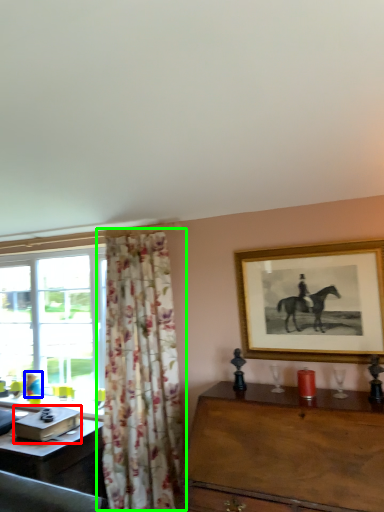
Question: Based on their relative distances, which object is farther from box (highlighted by a red box)? Choose from person (highlighted by a blue box) and curtain (highlighted by a green box).

Choices:
 (A) person
 (B) curtain

Answer: (A)